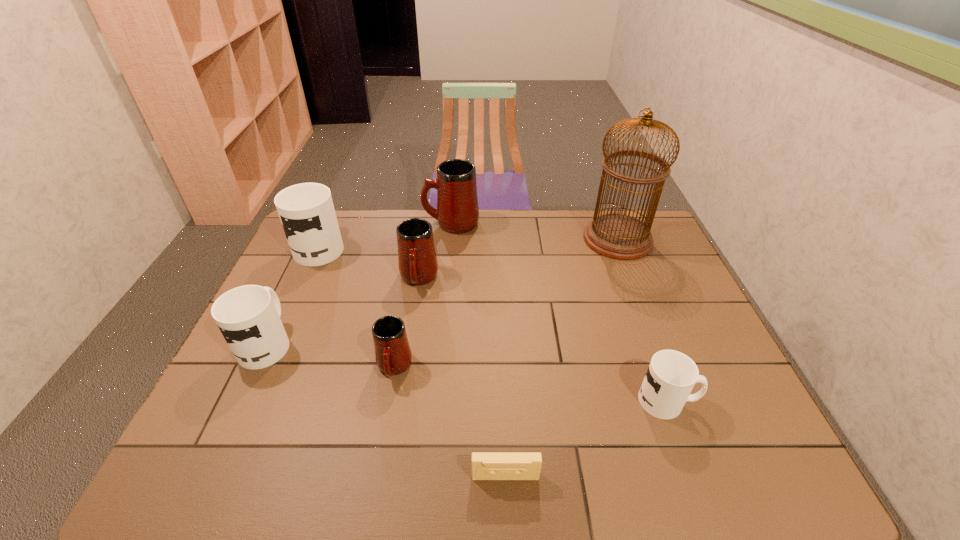
The height and width of the screenshot is (540, 960). I want to click on blank area located 0.290m on the front-facing side of the tallest object, so click(x=501, y=239).

Where is `vacant area situated on the front-facing side of the tallest object`? This screenshot has width=960, height=540. vacant area situated on the front-facing side of the tallest object is located at coordinates (561, 239).

At what (x,y) coordinates should I click in order to perform the action: click on vacant space positioned on the front-facing side of the tallest object. Please return your answer as a coordinate pair (x, y). This screenshot has height=540, width=960. Looking at the image, I should click on (547, 239).

Identify the location of vacant position located 0.380m on the side of the biggest red mug with the handle. (320, 223).

The image size is (960, 540). In order to click on vacant area situated on the side of the biggest red mug with the handle in this screenshot , I will do [345, 223].

Identify the location of vacant space located on the side of the biggest red mug with the handle. (394, 223).

Identify the location of free space located on the side of the second farthest red mug with the handle. (402, 382).

Locate an element on the screen. This screenshot has width=960, height=540. free space located 0.310m on the handle side of the second farthest white mug is located at coordinates (309, 252).

You are a GUI agent. You are given a task and a screenshot of the screen. Output one action in this format:
    pyautogui.click(x=<x>, y=<y>)
    Task: Click on the free space located on the handle side of the second farthest white mug
    This screenshot has height=540, width=960.
    Given the screenshot: What is the action you would take?
    pyautogui.click(x=307, y=255)

Where is `vacant space located 0.220m on the handle side of the second farthest white mug`? vacant space located 0.220m on the handle side of the second farthest white mug is located at coordinates (301, 269).